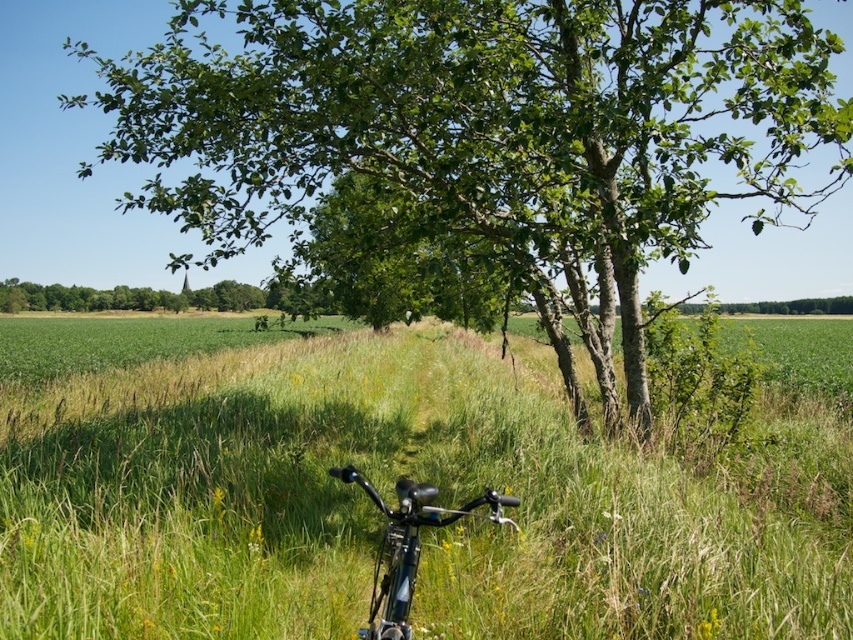
Is green grassy at lower center wider than green leafy tree at center?

Yes, green grassy at lower center is wider than green leafy tree at center.

Is point (664, 604) closer to viewer compared to point (199, 138)?

Yes.

Measure the distance between green grassy at lower center and camera.

A distance of 3.15 meters exists between green grassy at lower center and camera.

Locate an element on the screen. The height and width of the screenshot is (640, 853). green grassy at lower center is located at coordinates (387, 492).

Measure the distance between green grassy at lower center and shiny metallic bicycle at lower center.

24.33 feet

Is green grassy at lower center below shiny metallic bicycle at lower center?

No.

Who is more distant from viewer, (340, 554) or (380, 509)?

Positioned behind is point (340, 554).

The image size is (853, 640). Find the location of `green grassy at lower center`. green grassy at lower center is located at coordinates (387, 492).

Is green leafy tree at center wider than shiny metallic bicycle at lower center?

Yes, green leafy tree at center is wider than shiny metallic bicycle at lower center.

Does green leafy tree at center have a greater height compared to shiny metallic bicycle at lower center?

Yes.

The height and width of the screenshot is (640, 853). In order to click on green leafy tree at center in this screenshot , I will do `click(486, 122)`.

At what (x,y) coordinates should I click in order to perform the action: click on green leafy tree at center. Please return your answer as a coordinate pair (x, y). This screenshot has height=640, width=853. Looking at the image, I should click on (486, 122).